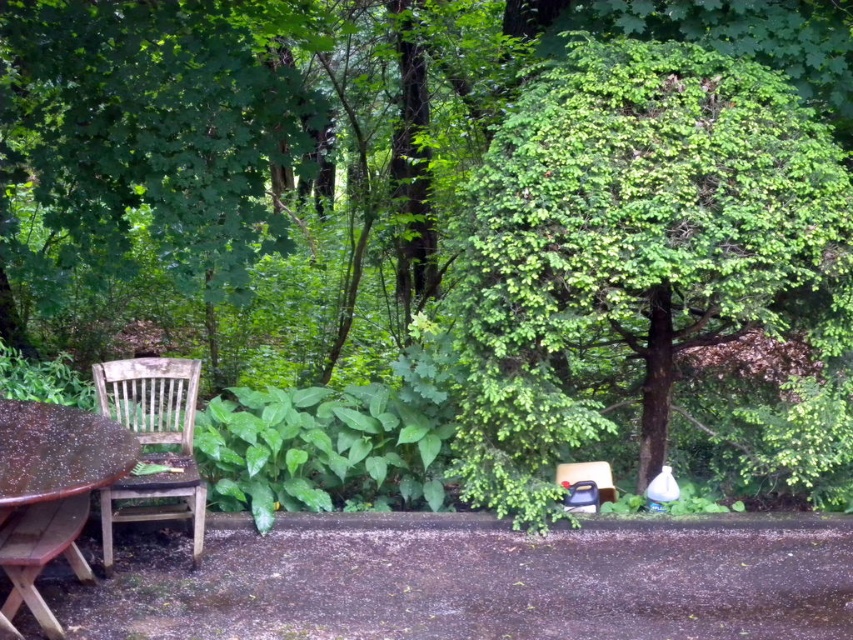
You are planning to set up a small garden party and need to place a 3m wide canopy. The green leafy tree at center and wooden picnic table at lower left are in the way. Which object would you need to move to accommodate the canopy?

The green leafy tree at center would need to be moved because it might be wider than the wooden picnic table at lower left, making it a larger obstruction for the 3m wide canopy.

You are a gardener who needs to water the green leafy tree at center. You are standing next to the worn wood chair at left. The watering can you have can spray water up to 5 feet. Will you be able to water the tree without moving closer?

The distance between the green leafy tree at center and the worn wood chair at left is 5.82 feet. Since the watering can can only spray up to 5 feet, you will need to move closer to reach the tree.

You are standing at the center of the image and see the point marked at coordinate (56,465). Which object is this point located on?

The point marked at coordinate (56,465) is located on the wooden picnic table at lower left.